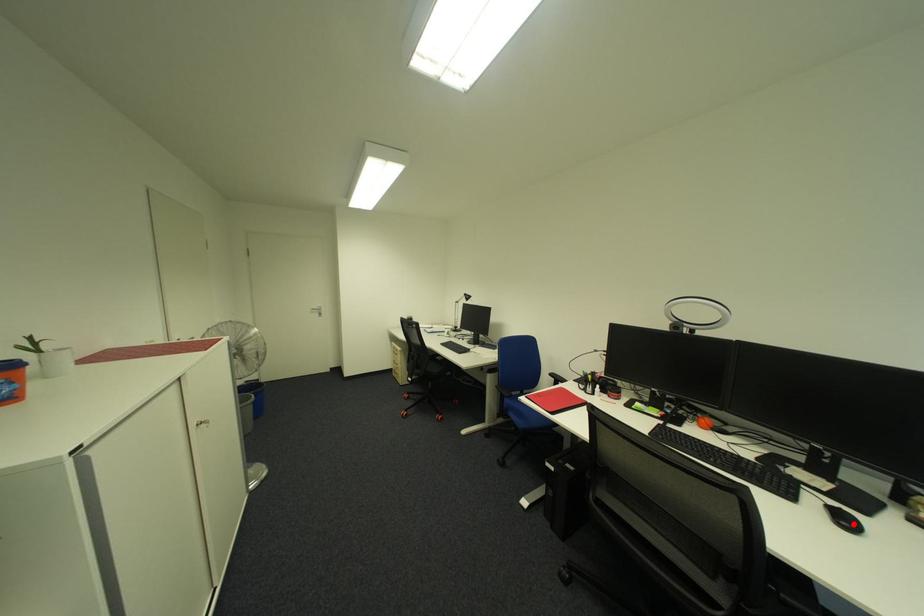
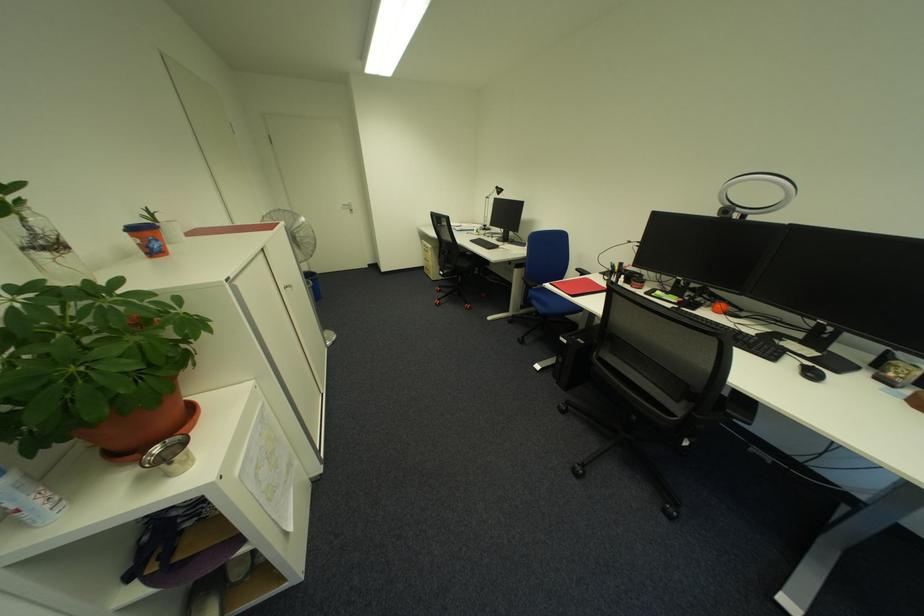
Where in the second image is the point corresponding to the highlighted location from the first image?

(820, 376)